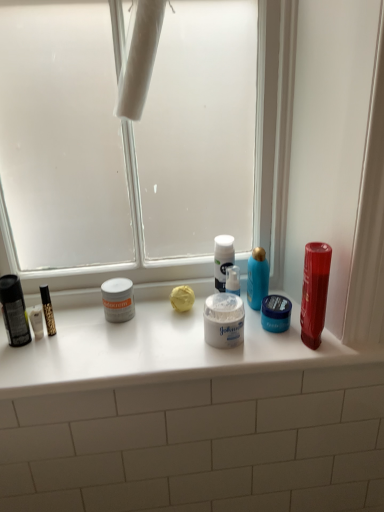
Question: Considering the positions of point (104, 307) and point (231, 314), is point (104, 307) closer or farther from the camera than point (231, 314)?

Choices:
 (A) farther
 (B) closer

Answer: (A)

Question: Looking at their shapes, would you say white matte jar at center, marked as the 1th toiletry in a left-to-right arrangement, is wider or thinner than white matte jar at center?

Choices:
 (A) wide
 (B) thin

Answer: (B)

Question: Which object is the closest to the white matte counter at center?

Choices:
 (A) shiny plastic mouthwash at right
 (B) transparent glass window screen at center
 (C) blue glossy bottle at center
 (D) white matte jar at center, marked as the 1th toiletry in a left-to-right arrangement
 (E) blue matte jar at center, the 2th toiletry viewed from the left

Answer: (D)

Question: Based on their relative distances, which object is nearer to the white matte counter at center?

Choices:
 (A) white matte jar at center, marked as the 1th toiletry in a left-to-right arrangement
 (B) blue glossy bottle at center
 (C) white matte jar at center
 (D) transparent glass window screen at center
 (E) blue matte jar at center, the 2th toiletry viewed from the left

Answer: (C)